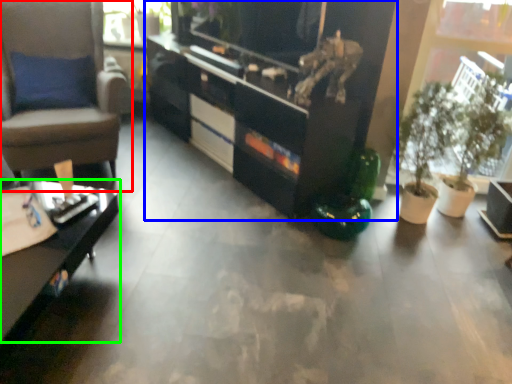
Question: Which object is positioned closest to chair (highlighted by a red box)? Select from cabinetry (highlighted by a blue box) and desk (highlighted by a green box).

Choices:
 (A) cabinetry
 (B) desk

Answer: (B)